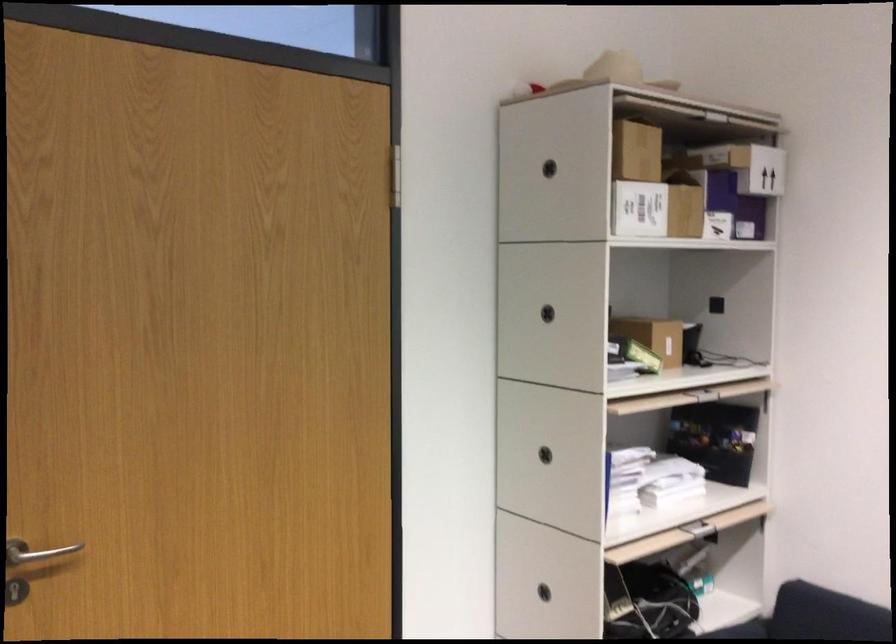
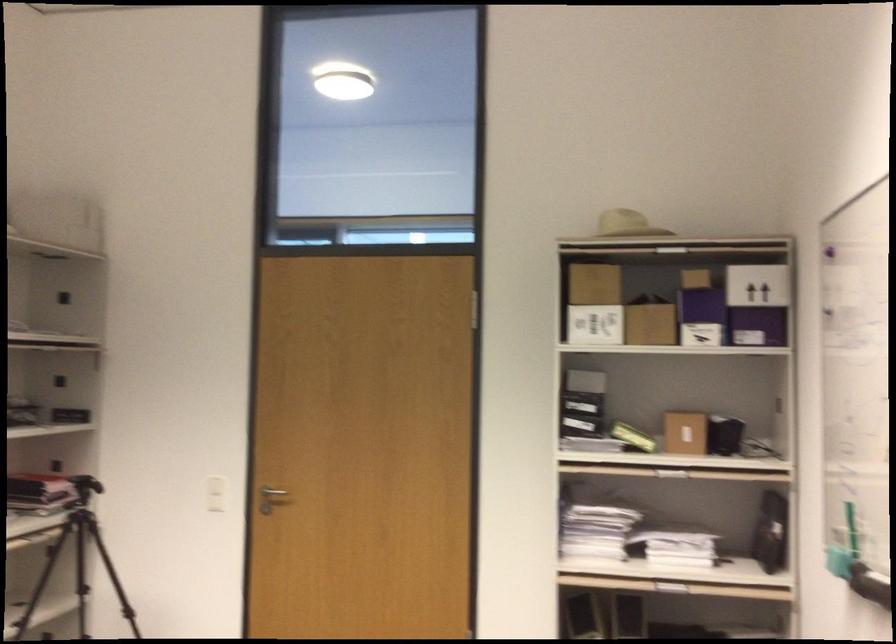
Locate, in the second image, the point that corresponds to [657,346] in the first image.

(684, 431)